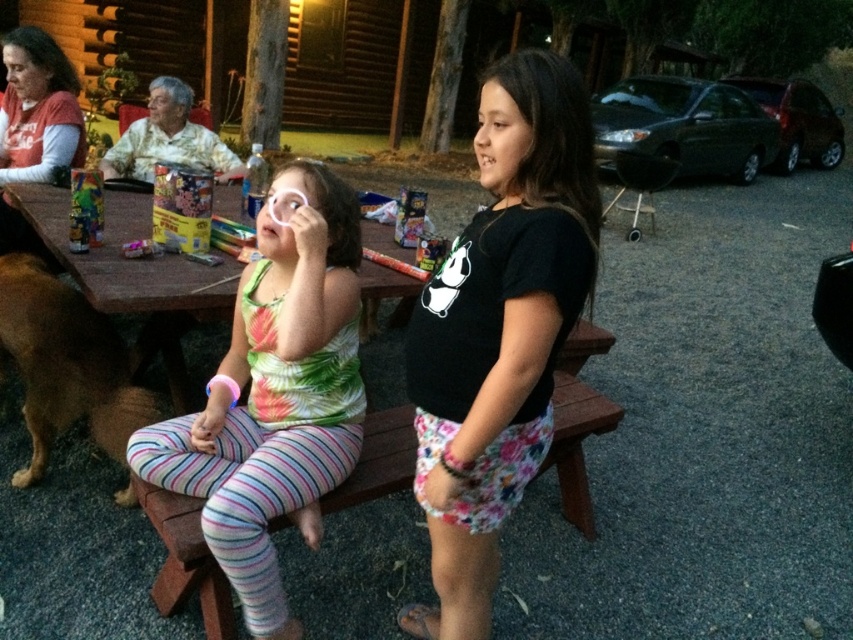
Question: Which of the following is the closest to the observer?

Choices:
 (A) (20, 81)
 (B) (225, 556)

Answer: (B)

Question: Which point is closer to the camera taking this photo?

Choices:
 (A) (148, 225)
 (B) (175, 156)
 (C) (56, 408)

Answer: (C)

Question: Can you confirm if multicolored striped leggings at left is positioned to the right of matte red shirt at upper left?

Choices:
 (A) no
 (B) yes

Answer: (B)

Question: Is brown fur dog at lower left thinner than matte red shirt at upper left?

Choices:
 (A) no
 (B) yes

Answer: (A)

Question: Can you confirm if black cotton shirt at center is positioned above matte red shirt at upper left?

Choices:
 (A) no
 (B) yes

Answer: (A)

Question: Which point is farther to the camera?

Choices:
 (A) (334, 196)
 (B) (68, 67)

Answer: (B)